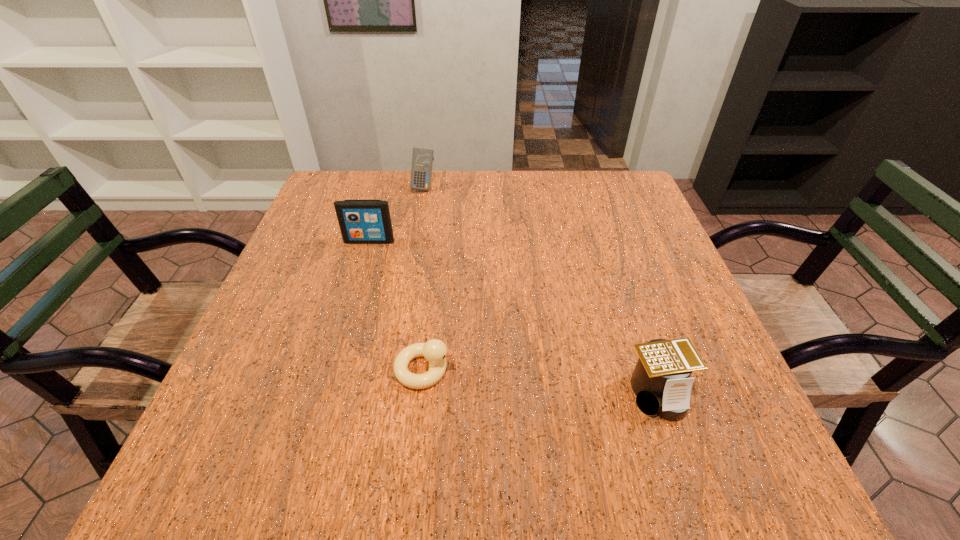
Locate an element on the screen. vacant area situated at the beak of the shortest object is located at coordinates (542, 369).

Find the location of `object positioned at the far edge`. object positioned at the far edge is located at coordinates (422, 159).

The width and height of the screenshot is (960, 540). In order to click on object present at the left edge in this screenshot , I will do `click(361, 221)`.

Where is `object located at the right edge`? This screenshot has width=960, height=540. object located at the right edge is located at coordinates (661, 381).

Find the location of a particular element. This screenshot has width=960, height=540. blank space at the far edge is located at coordinates (393, 191).

Where is `vacant position at the near edge of the desktop`? vacant position at the near edge of the desktop is located at coordinates (658, 448).

The height and width of the screenshot is (540, 960). Find the location of `vacant space at the left edge of the desktop`. vacant space at the left edge of the desktop is located at coordinates (287, 435).

Find the location of `free space at the right edge of the desktop`. free space at the right edge of the desktop is located at coordinates (612, 221).

At what (x,y) coordinates should I click in order to perform the action: click on vacant space at the far left corner of the desktop. Please return your answer as a coordinate pair (x, y). The height and width of the screenshot is (540, 960). Looking at the image, I should click on (316, 218).

This screenshot has height=540, width=960. In the image, there is a desktop. In order to click on vacant space at the far right corner in this screenshot , I will do (628, 217).